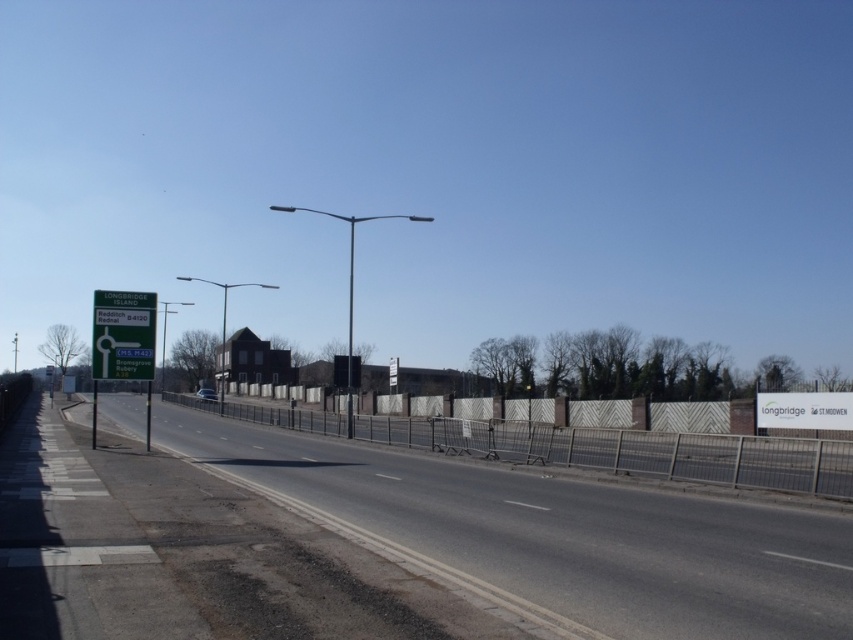
Does white wood fence at center appear on the right side of green plastic sign at left?

Yes, white wood fence at center is to the right of green plastic sign at left.

From the picture: Which of these two, white wood fence at center or green plastic sign at left, stands shorter?

Standing shorter between the two is green plastic sign at left.

What do you see at coordinates (633, 451) in the screenshot?
I see `white wood fence at center` at bounding box center [633, 451].

At what (x,y) coordinates should I click in order to perform the action: click on white wood fence at center. Please return your answer as a coordinate pair (x, y). Looking at the image, I should click on (633, 451).

Who is higher up, asphalt road at left or white wood fence at center?

asphalt road at left is higher up.

Between asphalt road at left and white wood fence at center, which one is positioned lower?

white wood fence at center

Who is more distant from viewer, (764, 563) or (833, 480)?

The point (833, 480) is more distant.

The image size is (853, 640). Find the location of `asphalt road at left`. asphalt road at left is located at coordinates (561, 534).

Who is positioned more to the left, asphalt road at left or green plastic sign at left?

Positioned to the left is green plastic sign at left.

Does asphalt road at left appear under green plastic sign at left?

Indeed, asphalt road at left is positioned under green plastic sign at left.

This screenshot has height=640, width=853. Describe the element at coordinates (561, 534) in the screenshot. I see `asphalt road at left` at that location.

Where is `asphalt road at left`? This screenshot has height=640, width=853. asphalt road at left is located at coordinates (561, 534).